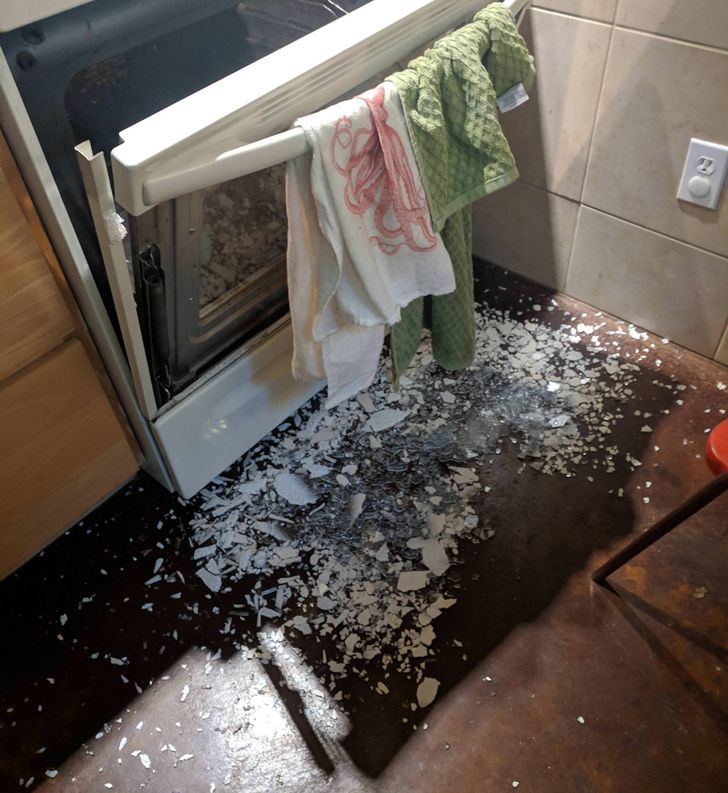
Image resolution: width=728 pixels, height=793 pixels. In order to click on outlet in this screenshot , I will do click(703, 165).